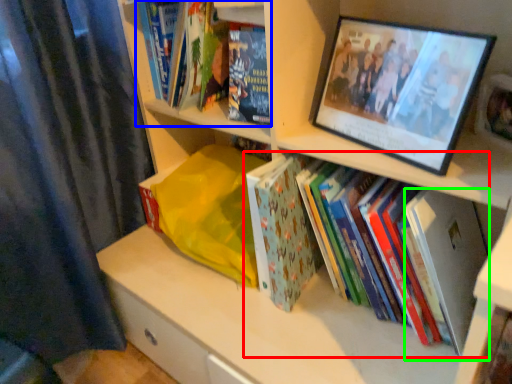
Question: Estimate the real-world distances between objects in this image. Which object is closer to book (highlighted by a red box), book (highlighted by a blue box) or paperback book (highlighted by a green box)?

Choices:
 (A) book
 (B) paperback book

Answer: (B)